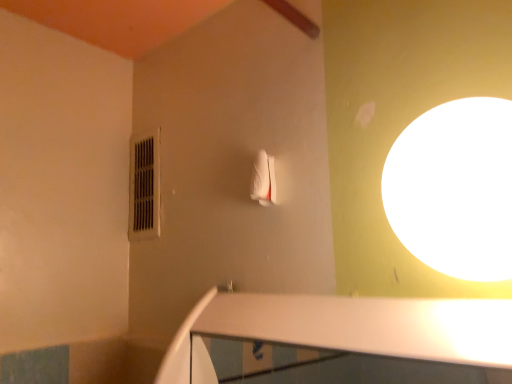
Question: Does white glossy light at upper right have a larger size compared to black plastic air conditioner at upper left?

Choices:
 (A) no
 (B) yes

Answer: (B)

Question: Is white glossy light at upper right positioned in front of black plastic air conditioner at upper left?

Choices:
 (A) no
 (B) yes

Answer: (B)

Question: Is white glossy light at upper right far away from black plastic air conditioner at upper left?

Choices:
 (A) no
 (B) yes

Answer: (A)

Question: Does white glossy light at upper right touch black plastic air conditioner at upper left?

Choices:
 (A) yes
 (B) no

Answer: (B)

Question: Can you confirm if white glossy light at upper right is wider than black plastic air conditioner at upper left?

Choices:
 (A) yes
 (B) no

Answer: (A)

Question: From the image's perspective, does white glossy light at upper right appear lower than black plastic air conditioner at upper left?

Choices:
 (A) yes
 (B) no

Answer: (A)

Question: Does black plastic air conditioner at upper left appear on the left side of white glossy light at upper right?

Choices:
 (A) no
 (B) yes

Answer: (B)

Question: From a real-world perspective, is black plastic air conditioner at upper left on top of white glossy light at upper right?

Choices:
 (A) yes
 (B) no

Answer: (A)

Question: Does black plastic air conditioner at upper left have a greater width compared to white glossy light at upper right?

Choices:
 (A) yes
 (B) no

Answer: (B)

Question: From a real-world perspective, does black plastic air conditioner at upper left sit lower than white glossy light at upper right?

Choices:
 (A) no
 (B) yes

Answer: (A)

Question: From the image's perspective, is black plastic air conditioner at upper left above white glossy light at upper right?

Choices:
 (A) no
 (B) yes

Answer: (B)

Question: Is the depth of black plastic air conditioner at upper left greater than that of white glossy light at upper right?

Choices:
 (A) no
 (B) yes

Answer: (B)

Question: From a real-world perspective, relative to white glossy light at upper right, is black plastic air conditioner at upper left vertically above or below?

Choices:
 (A) below
 (B) above

Answer: (B)